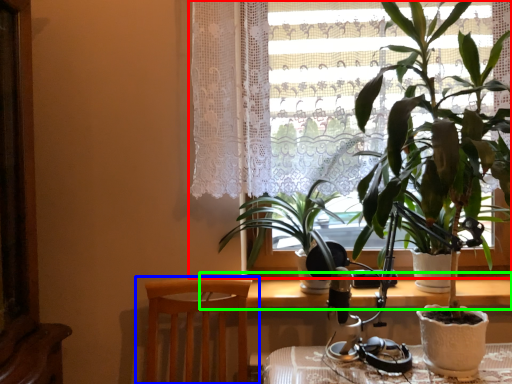
Question: Which is farther away from window (highlighted by a red box)? chair (highlighted by a blue box) or table (highlighted by a green box)?

Choices:
 (A) chair
 (B) table

Answer: (B)